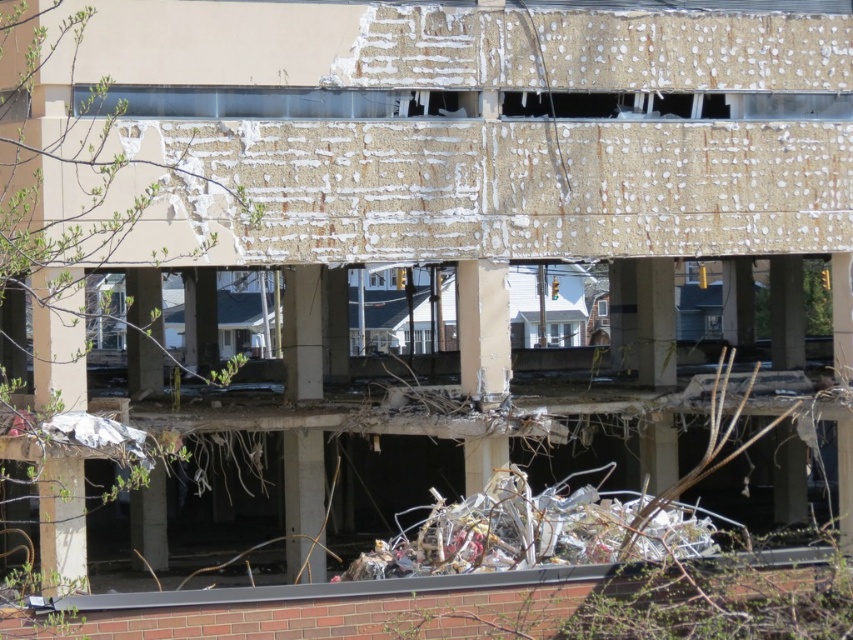
Question: Which point is closer to the camera taking this photo?

Choices:
 (A) (287, 356)
 (B) (692, 544)
 (C) (498, 378)

Answer: (B)

Question: Which of the following is the farthest from the observer?

Choices:
 (A) shiny metallic scrap at center
 (B) concrete at center

Answer: (B)

Question: Can you confirm if shiny metallic scrap at center is bigger than concrete pillar at center?

Choices:
 (A) no
 (B) yes

Answer: (B)

Question: Observing the image, what is the correct spatial positioning of shiny metallic scrap at center in reference to concrete pillar at center?

Choices:
 (A) left
 (B) right

Answer: (B)

Question: Which point appears farthest from the camera in this image?

Choices:
 (A) (509, 493)
 (B) (485, 333)
 (C) (309, 388)

Answer: (C)

Question: Is shiny metallic scrap at center wider than concrete at center?

Choices:
 (A) yes
 (B) no

Answer: (A)